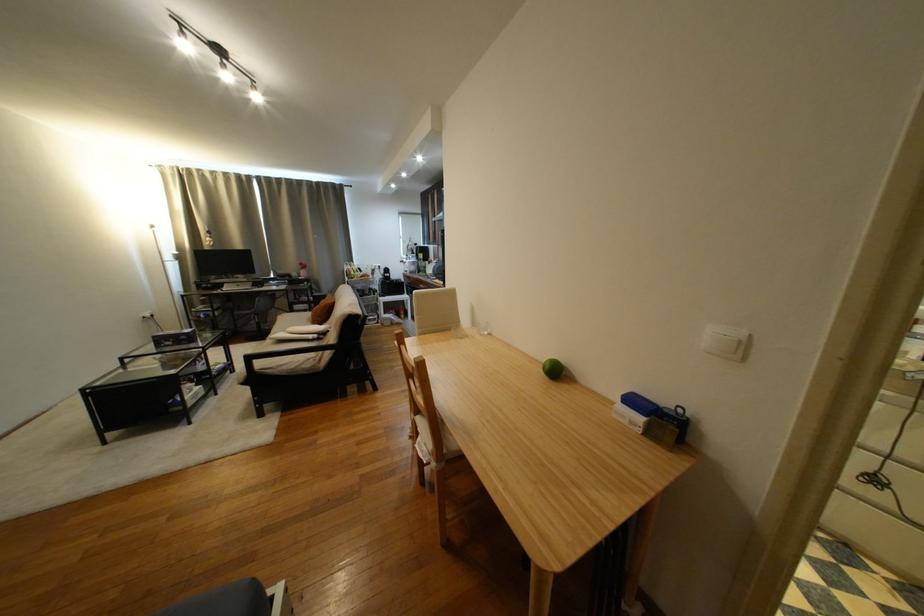
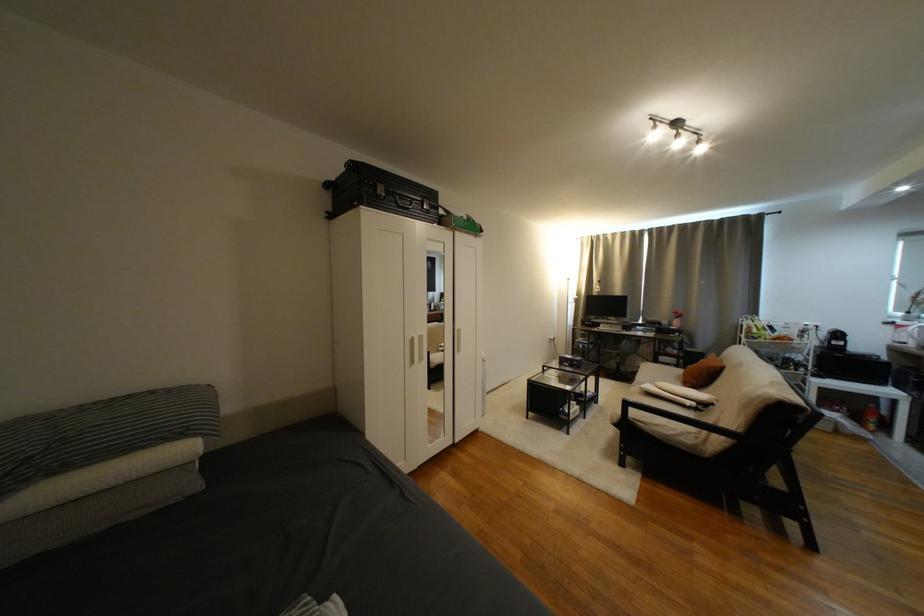
Question: Based on the continuous images, in which direction is the camera rotating? Reply with the corresponding letter.

Choices:
 (A) Left
 (B) Right
 (C) Up
 (D) Down

Answer: (A)